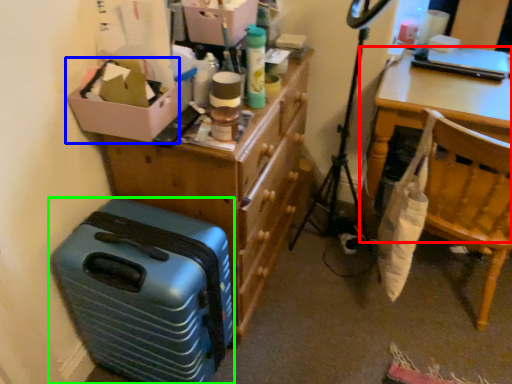
Question: Which object is positioned farthest from desk (highlighted by a red box)? Select from box (highlighted by a blue box) and suitcase (highlighted by a green box).

Choices:
 (A) box
 (B) suitcase

Answer: (B)